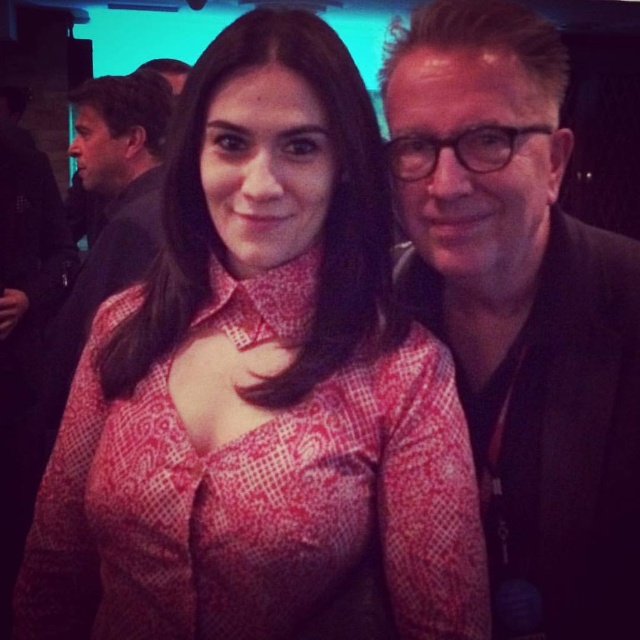
Question: Does matte black suit at right come in front of matte black suit at center?

Choices:
 (A) yes
 (B) no

Answer: (A)

Question: Which point appears farthest from the camera in this image?

Choices:
 (A) (90, 304)
 (B) (544, 490)

Answer: (A)

Question: Can you confirm if pink patterned blouse at center is positioned to the left of matte black suit at center?

Choices:
 (A) yes
 (B) no

Answer: (B)

Question: Which object is positioned closest to the pink patterned blouse at center?

Choices:
 (A) matte black suit at right
 (B) matte black suit at center

Answer: (A)

Question: Which of these objects is positioned closest to the matte black suit at right?

Choices:
 (A) matte black suit at center
 (B) pink patterned blouse at center

Answer: (B)

Question: Considering the relative positions of pink patterned blouse at center and matte black suit at center in the image provided, where is pink patterned blouse at center located with respect to matte black suit at center?

Choices:
 (A) left
 (B) right

Answer: (B)